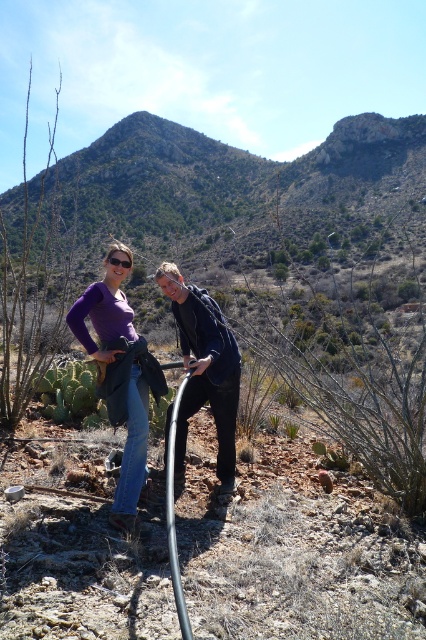
Question: Does black matte jacket at center appear on the left side of matte purple shirt at center?

Choices:
 (A) yes
 (B) no

Answer: (B)

Question: Does black matte jacket at center appear over matte purple shirt at center?

Choices:
 (A) yes
 (B) no

Answer: (B)

Question: Can you confirm if black matte jacket at center is positioned to the left of matte purple shirt at center?

Choices:
 (A) no
 (B) yes

Answer: (A)

Question: Among these points, which one is nearest to the camera?

Choices:
 (A) (138, 454)
 (B) (226, 492)

Answer: (A)